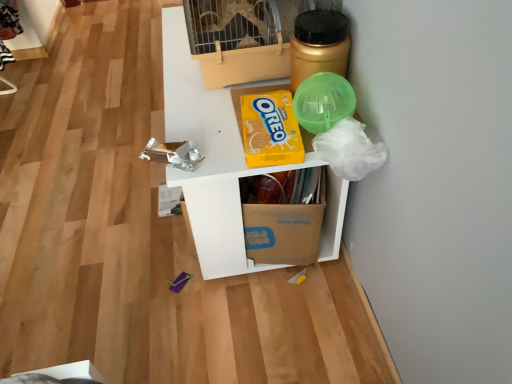
The width and height of the screenshot is (512, 384). Find the location of `blank area to the left of gold metallic jar at upper right`. blank area to the left of gold metallic jar at upper right is located at coordinates (219, 113).